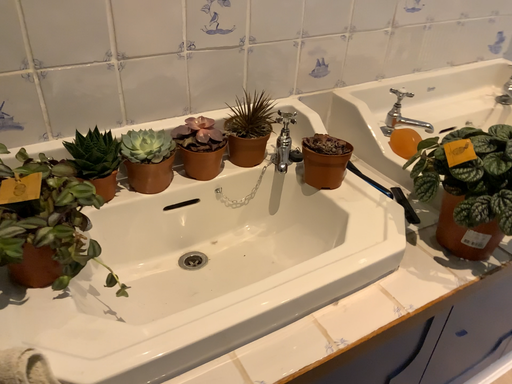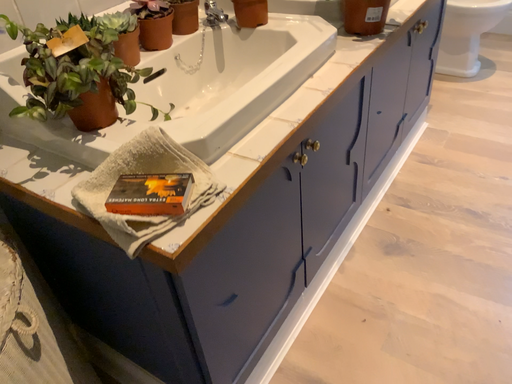
Question: Which way did the camera rotate in the video?

Choices:
 (A) rotated right
 (B) rotated left

Answer: (A)